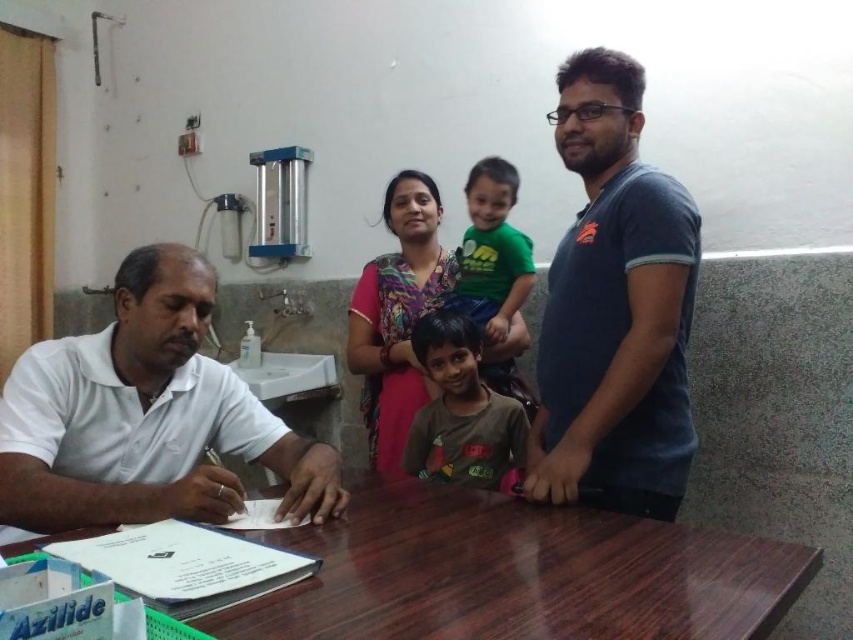
Which is in front, point (90, 387) or point (453, 429)?

Point (90, 387)

Between white matte shirt at left and brown cotton shirt at center, which one is positioned lower?

white matte shirt at left is lower down.

Between point (93, 481) and point (456, 474), which one is positioned behind?

Positioned behind is point (456, 474).

Locate an element on the screen. The height and width of the screenshot is (640, 853). white matte shirt at left is located at coordinates (144, 417).

From the picture: Is multicolored fabric family at center wider than brown cotton shirt at center?

Indeed, multicolored fabric family at center has a greater width compared to brown cotton shirt at center.

Is point (399, 401) in front of point (489, 406)?

No, it is behind (489, 406).

Who is more forward, (422, 282) or (517, 476)?

Point (517, 476) is in front.

The height and width of the screenshot is (640, 853). In order to click on multicolored fabric family at center in this screenshot , I will do pos(397,316).

Measure the distance between blue cotton t-shirt at right and multicolored fabric family at center.

blue cotton t-shirt at right and multicolored fabric family at center are 30.63 inches apart from each other.

The width and height of the screenshot is (853, 640). Describe the element at coordinates (614, 308) in the screenshot. I see `blue cotton t-shirt at right` at that location.

Image resolution: width=853 pixels, height=640 pixels. What are the coordinates of `blue cotton t-shirt at right` in the screenshot? It's located at (614, 308).